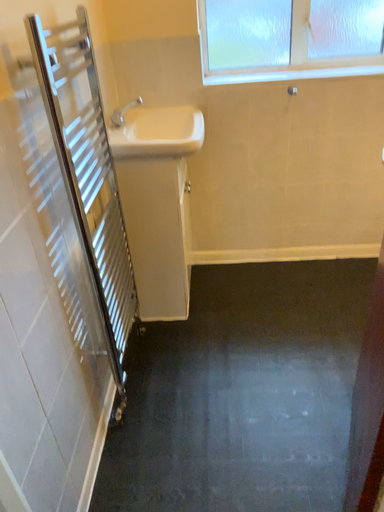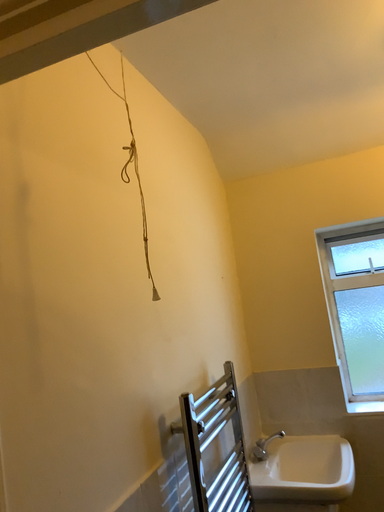
Question: Which way did the camera rotate in the video?

Choices:
 (A) rotated downward
 (B) rotated upward

Answer: (B)